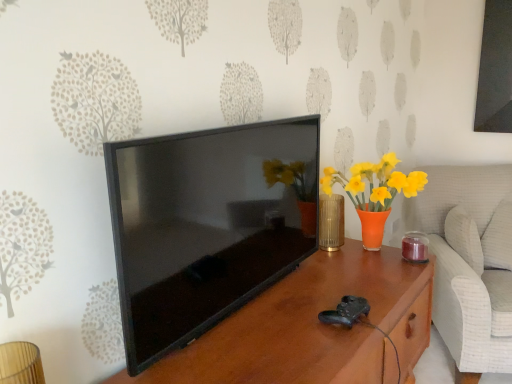
Question: Considering the relative sizes of brown wood table at center and white textured swivel chair at right in the image provided, is brown wood table at center smaller than white textured swivel chair at right?

Choices:
 (A) no
 (B) yes

Answer: (B)

Question: From the image's perspective, is brown wood table at center located above white textured swivel chair at right?

Choices:
 (A) no
 (B) yes

Answer: (A)

Question: Is brown wood table at center turned away from white textured swivel chair at right?

Choices:
 (A) no
 (B) yes

Answer: (A)

Question: Is brown wood table at center aimed at white textured swivel chair at right?

Choices:
 (A) no
 (B) yes

Answer: (A)

Question: Does brown wood table at center lie behind white textured swivel chair at right?

Choices:
 (A) no
 (B) yes

Answer: (A)

Question: Is brown wood table at center to the right of white textured swivel chair at right from the viewer's perspective?

Choices:
 (A) yes
 (B) no

Answer: (B)

Question: Is white textured swivel chair at right completely or partially outside of gold textured vase at center?

Choices:
 (A) no
 (B) yes

Answer: (B)

Question: Does white textured swivel chair at right have a greater height compared to gold textured vase at center?

Choices:
 (A) no
 (B) yes

Answer: (B)

Question: Does white textured swivel chair at right lie behind gold textured vase at center?

Choices:
 (A) yes
 (B) no

Answer: (B)

Question: Does white textured swivel chair at right come in front of gold textured vase at center?

Choices:
 (A) yes
 (B) no

Answer: (A)

Question: Is white textured swivel chair at right far away from gold textured vase at center?

Choices:
 (A) no
 (B) yes

Answer: (A)

Question: From the image's perspective, is white textured swivel chair at right over gold textured vase at center?

Choices:
 (A) yes
 (B) no

Answer: (B)

Question: Does gold textured vase at center have a larger size compared to white textured swivel chair at right?

Choices:
 (A) yes
 (B) no

Answer: (B)